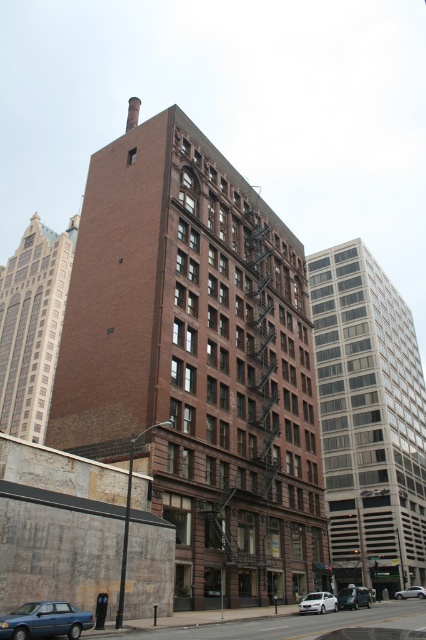
Question: Estimate the real-world distances between objects in this image. Which object is farther from the white matte car at lower center?

Choices:
 (A) blue metallic sedan at lower left
 (B) silver metallic sedan at lower right
 (C) silver metallic car at lower right

Answer: (C)

Question: Which object appears farthest from the camera in this image?

Choices:
 (A) silver metallic sedan at lower right
 (B) silver metallic car at lower right

Answer: (B)

Question: Does white matte car at lower center appear under silver metallic car at lower right?

Choices:
 (A) yes
 (B) no

Answer: (B)

Question: Is white matte car at lower center smaller than silver metallic car at lower right?

Choices:
 (A) yes
 (B) no

Answer: (B)

Question: Based on their relative distances, which object is farther from the silver metallic sedan at lower right?

Choices:
 (A) white matte car at lower center
 (B) blue metallic sedan at lower left
 (C) silver metallic car at lower right

Answer: (B)

Question: Can you confirm if blue metallic sedan at lower left is positioned to the right of white matte car at lower center?

Choices:
 (A) yes
 (B) no

Answer: (B)